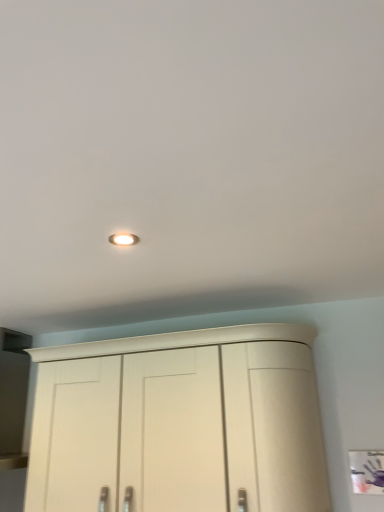
Question: Is white glossy light fixture at upper center at the left side of matte white cupboard at lower center?

Choices:
 (A) yes
 (B) no

Answer: (A)

Question: Considering the relative sizes of white glossy light fixture at upper center and matte white cupboard at lower center in the image provided, is white glossy light fixture at upper center bigger than matte white cupboard at lower center?

Choices:
 (A) yes
 (B) no

Answer: (B)

Question: Would you consider white glossy light fixture at upper center to be distant from matte white cupboard at lower center?

Choices:
 (A) yes
 (B) no

Answer: (B)

Question: From a real-world perspective, is white glossy light fixture at upper center on top of matte white cupboard at lower center?

Choices:
 (A) no
 (B) yes

Answer: (B)

Question: Is white glossy light fixture at upper center taller than matte white cupboard at lower center?

Choices:
 (A) no
 (B) yes

Answer: (A)

Question: From the image's perspective, is white glossy light fixture at upper center below matte white cupboard at lower center?

Choices:
 (A) no
 (B) yes

Answer: (A)

Question: From a real-world perspective, is matte white cupboard at lower center below white glossy light fixture at upper center?

Choices:
 (A) yes
 (B) no

Answer: (A)

Question: Is matte white cupboard at lower center to the left of white glossy light fixture at upper center from the viewer's perspective?

Choices:
 (A) no
 (B) yes

Answer: (A)

Question: Is matte white cupboard at lower center positioned before white glossy light fixture at upper center?

Choices:
 (A) yes
 (B) no

Answer: (B)

Question: Is the surface of matte white cupboard at lower center in direct contact with white glossy light fixture at upper center?

Choices:
 (A) yes
 (B) no

Answer: (B)

Question: Considering the relative sizes of matte white cupboard at lower center and white glossy light fixture at upper center in the image provided, is matte white cupboard at lower center shorter than white glossy light fixture at upper center?

Choices:
 (A) yes
 (B) no

Answer: (B)

Question: From a real-world perspective, is matte white cupboard at lower center over white glossy light fixture at upper center?

Choices:
 (A) no
 (B) yes

Answer: (A)

Question: Considering the positions of point (157, 480) and point (134, 242), is point (157, 480) closer or farther from the camera than point (134, 242)?

Choices:
 (A) farther
 (B) closer

Answer: (A)